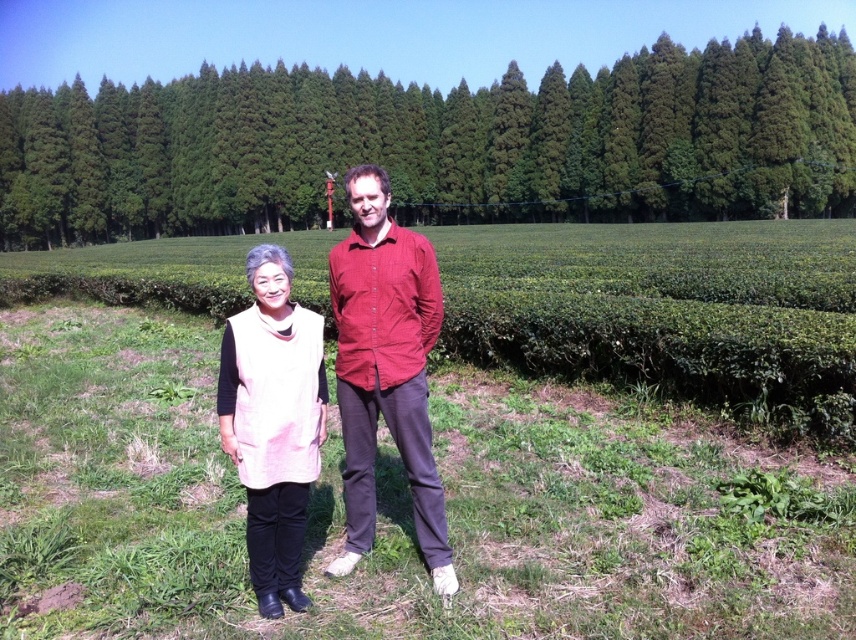
You are a photographer taking a picture of the two people in the tea plantation. You notice the green leafy trees at center and the pink fabric vest at center. Which object is positioned higher in the image?

The green leafy trees at center are positioned higher than the pink fabric vest at center in the image.

You are a photographer trying to capture a photo of the pink fabric vest at center and the green leafy vineyard at center. Which object is located to the left of the other?

The green leafy vineyard at center is positioned on the left side of pink fabric vest at center, so the vineyard is to the left of the vest.

You are standing at the origin point of the coordinate system in the image. There is a green leafy trees at center at point [438,144]. What is the coordinate of the green leafy trees at center?

The green leafy trees at center is located at point [438,144].